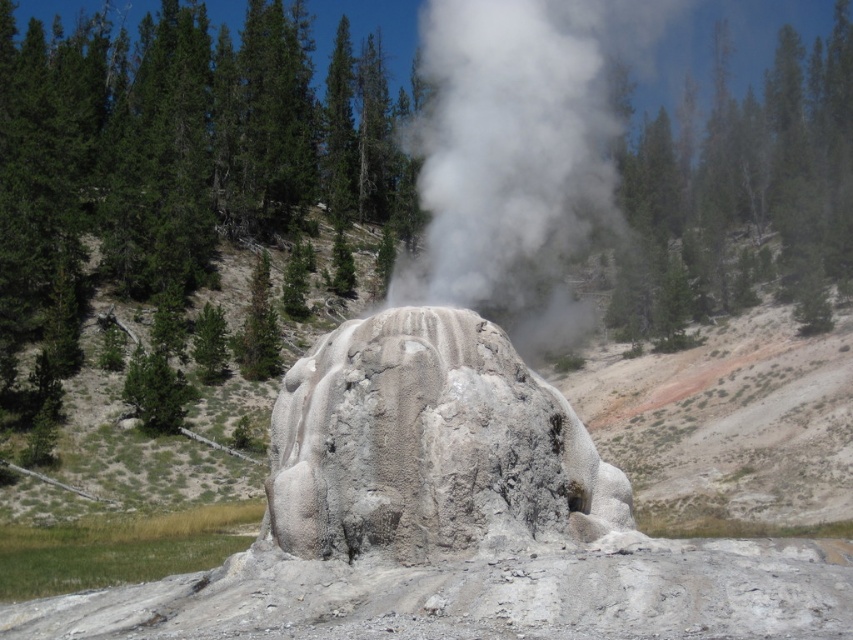
You are a geologist studying the geothermal area. You need to place a temperature sensor exactly at the center of the white textured rock at center. According to the coordinates provided, where should you place the sensor?

The temperature sensor should be placed at the coordinates point (x=428, y=445), which is the exact position of the white textured rock at center.

You are a geologist examining the geothermal site. You notice the white rock formation at center and the white vapor steam at center. Which of these two features is wider in terms of their spread across the image?

The white vapor steam at center is wider than the white rock formation at center, so the vapor steam has a greater spread across the image.